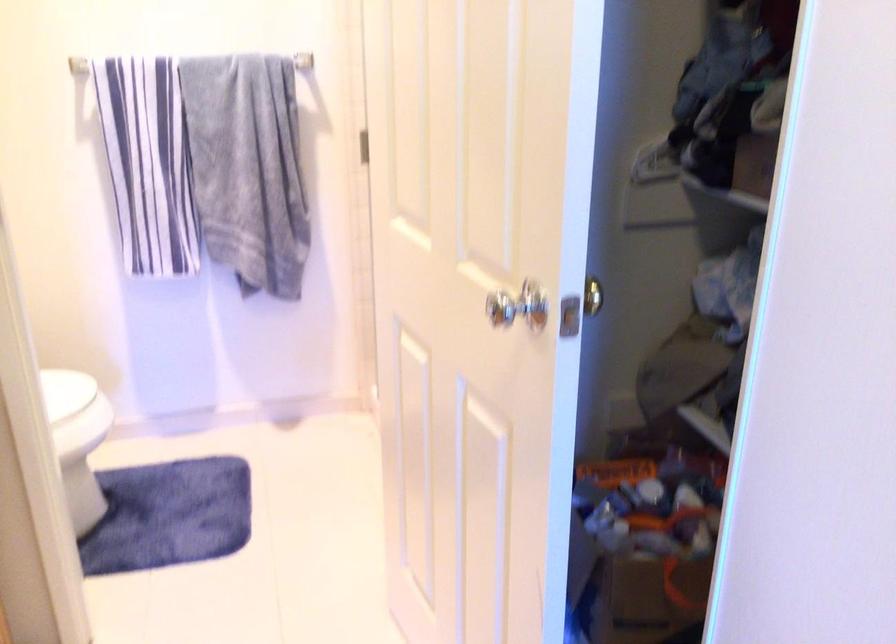
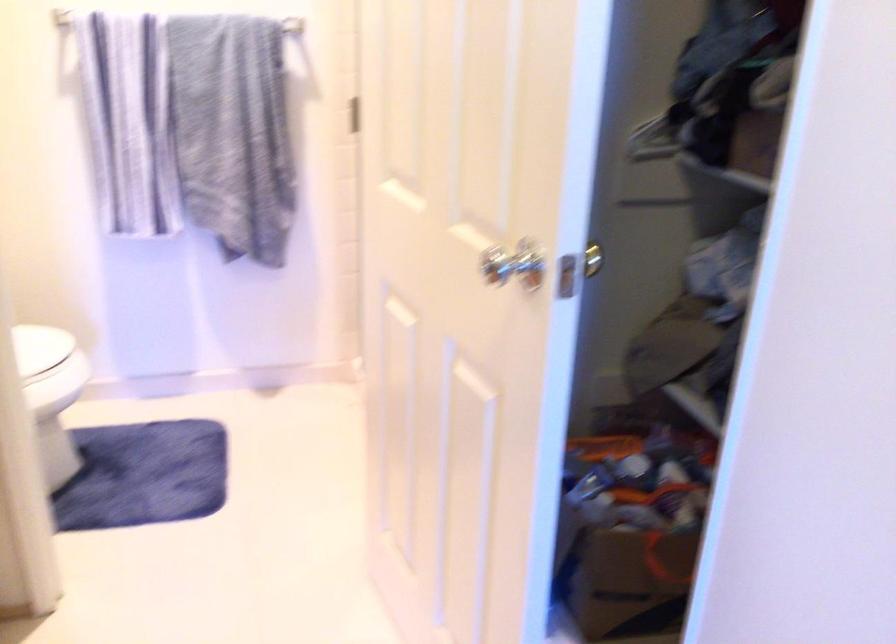
Find the pixel in the second image that matches (71,411) in the first image.

(45, 368)